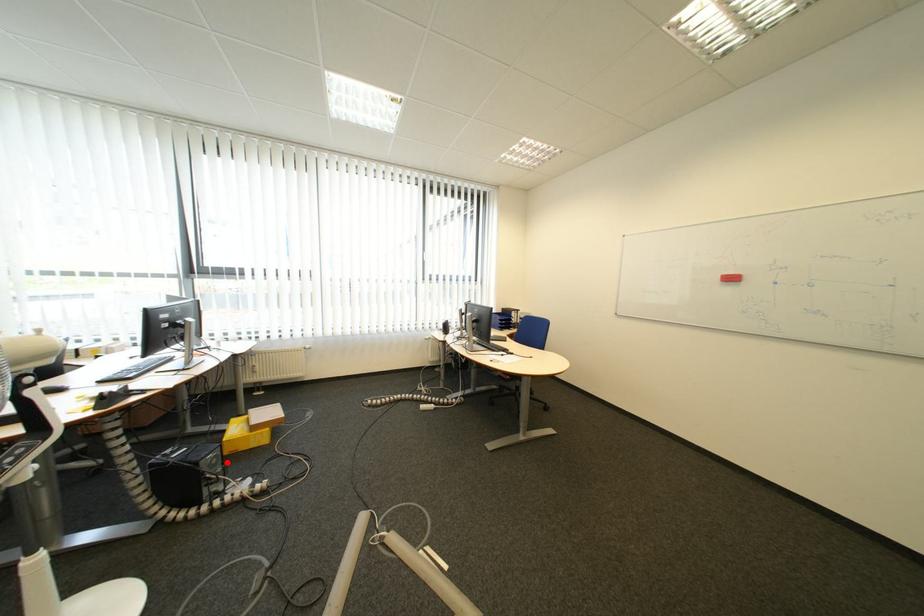
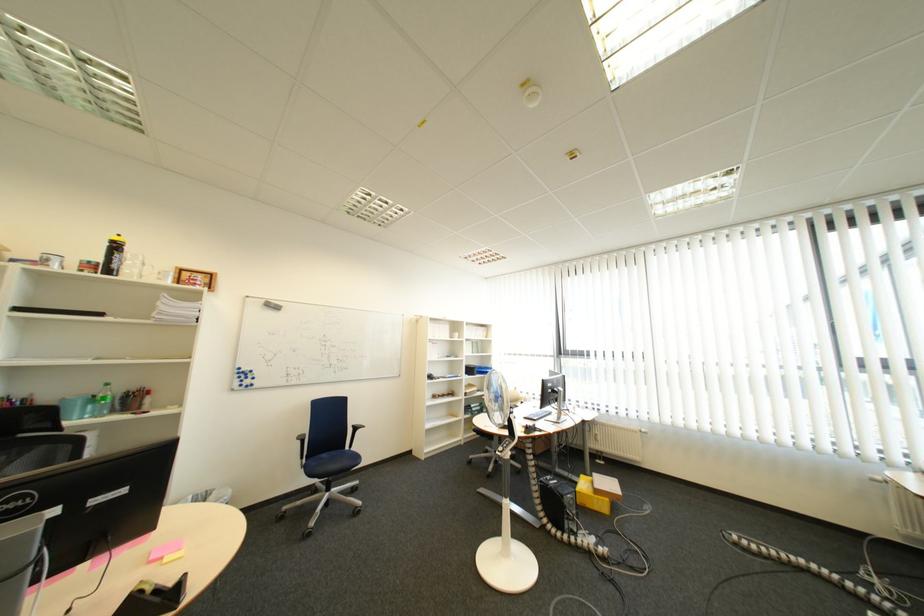
The point at the highlighted location is marked in the first image. Where is the corresponding point in the second image?

(585, 503)